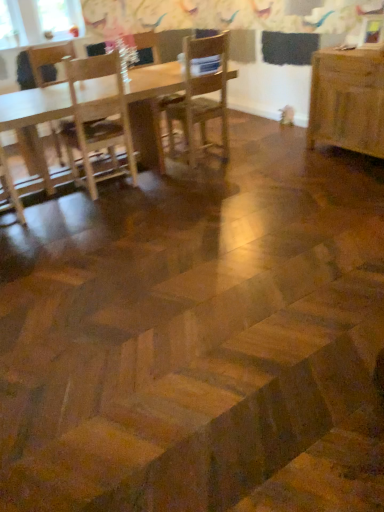
Question: From the image's perspective, relative to wooden chair at center, positioned as the 2th chair in left-to-right order, is wooden table at upper left, placed as the second table when sorted from right to left, above or below?

Choices:
 (A) below
 (B) above

Answer: (A)

Question: Is wooden table at upper left, the 1th table in the left-to-right sequence, taller or shorter than wooden chair at center, positioned as the 2th chair in left-to-right order?

Choices:
 (A) short
 (B) tall

Answer: (A)

Question: Which of these objects is positioned closest to the wooden chair at center, which ranks as the second chair in right-to-left order?

Choices:
 (A) clear glass window screen at upper left
 (B) wooden table at upper left, the 1th table in the left-to-right sequence
 (C) light brown wooden chair at left, which is the third chair in right-to-left order
 (D) wooden table at right, which is the 1th table in right-to-left order
 (E) wooden chair at center, which is counted as the third chair, starting from the left

Answer: (E)

Question: Which object is the closest to the wooden chair at center, which is counted as the third chair, starting from the left?

Choices:
 (A) light brown wooden chair at left, which is the third chair in right-to-left order
 (B) clear glass window screen at upper left
 (C) wooden table at upper left, placed as the second table when sorted from right to left
 (D) wooden table at right, which is the 1th table in right-to-left order
 (E) wooden chair at center, positioned as the 2th chair in left-to-right order

Answer: (E)